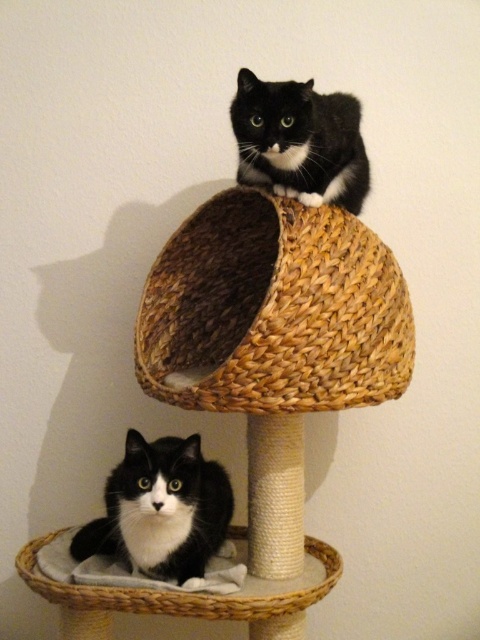
You are a cat owner trying to place a new toy on the woven fabric cat bed at lower center. The black matte fur cat at upper center is currently on the cat tree. Which direction should you approach from to avoid disturbing the cat?

You should approach from below the woven fabric cat bed at lower center since the black matte fur cat at upper center is further to the viewer and might not notice you if you come from a lower angle.

Consider the image. You are a cat owner trying to locate your cat. Your cat is the black matte fur cat at upper center. You see the woven straw basket at upper center. Which direction should you move to find your cat?

The woven straw basket at upper center is to the left of black matte fur cat at upper center, so you should move to the right to find your cat.

You are a cat owner who wants to place a toy in the woven straw basket at upper center. If your hand is 39.27 inches away from the basket, can you reach it without moving your body?

The woven straw basket at upper center is 39.27 inches away from the viewer. Since the average human arm length is about 25 to 30 inches, you cannot reach the woven straw basket at upper center without moving your body.